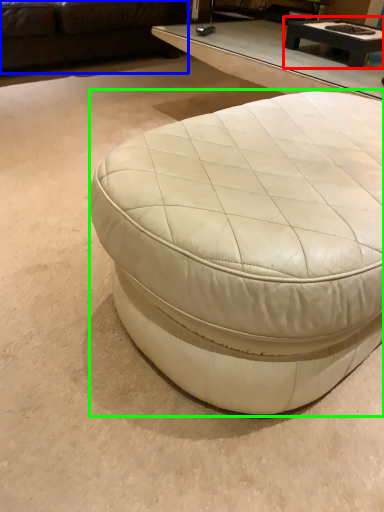
Question: Based on their relative distances, which object is farther from coffee table (highlighted by a red box)? Choose from studio couch (highlighted by a blue box) and coffee table (highlighted by a green box).

Choices:
 (A) studio couch
 (B) coffee table

Answer: (A)